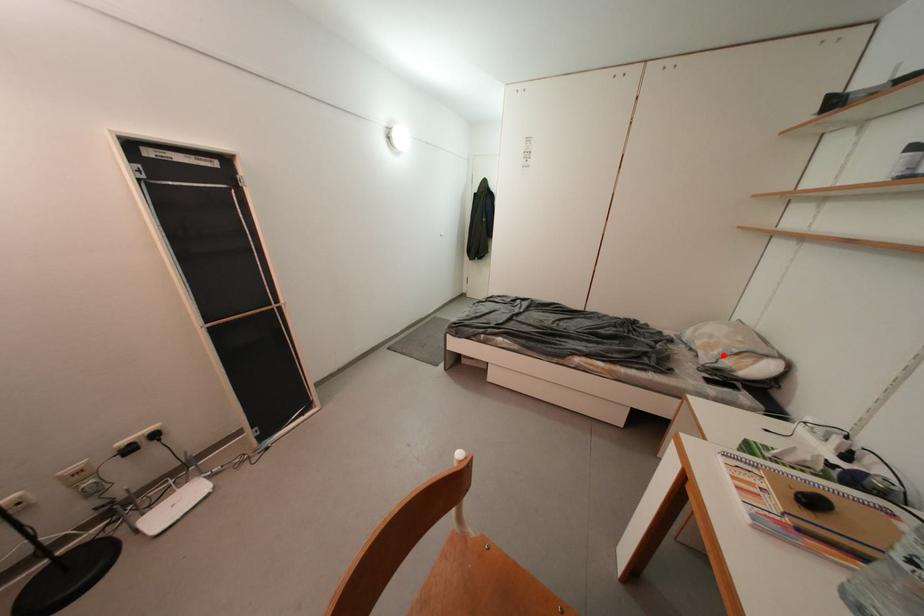
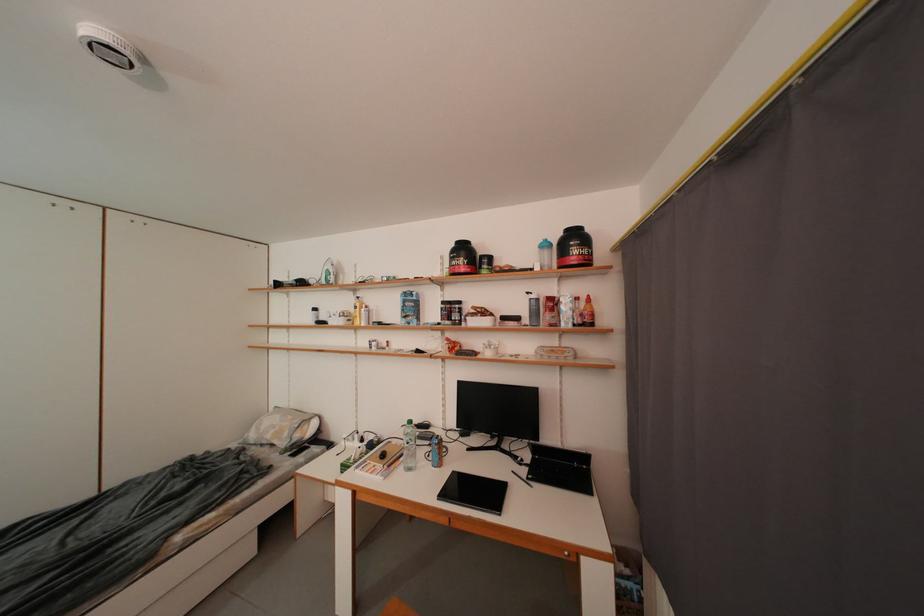
Locate, in the second image, the point that corresponds to the highlighted location in the first image.

(294, 438)